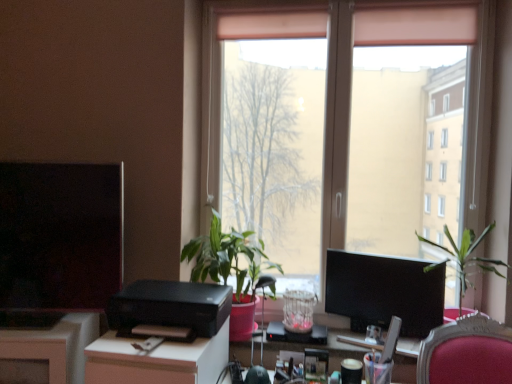
Find the location of `free point above black plastic printer at center (from a real-world perspective)`. free point above black plastic printer at center (from a real-world perspective) is located at coordinates (177, 294).